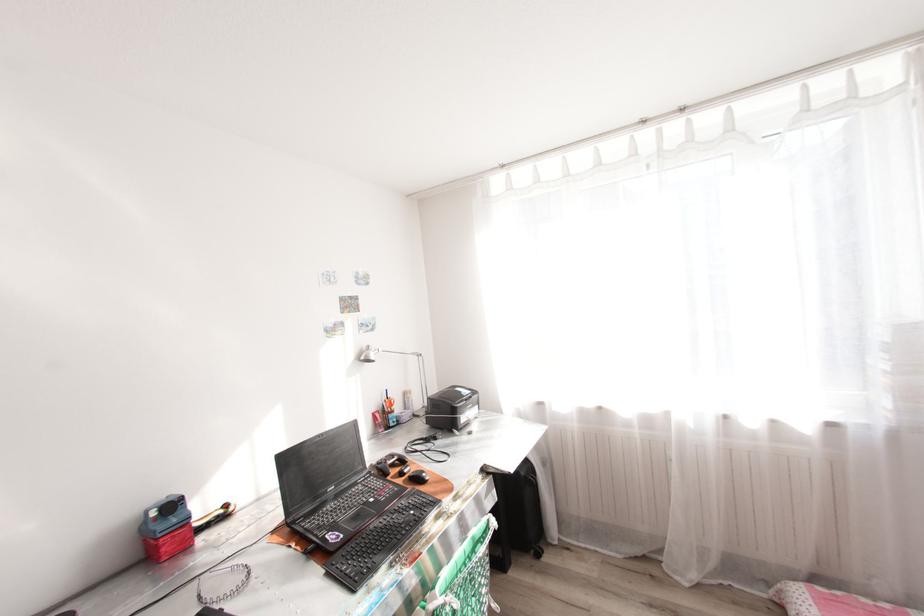
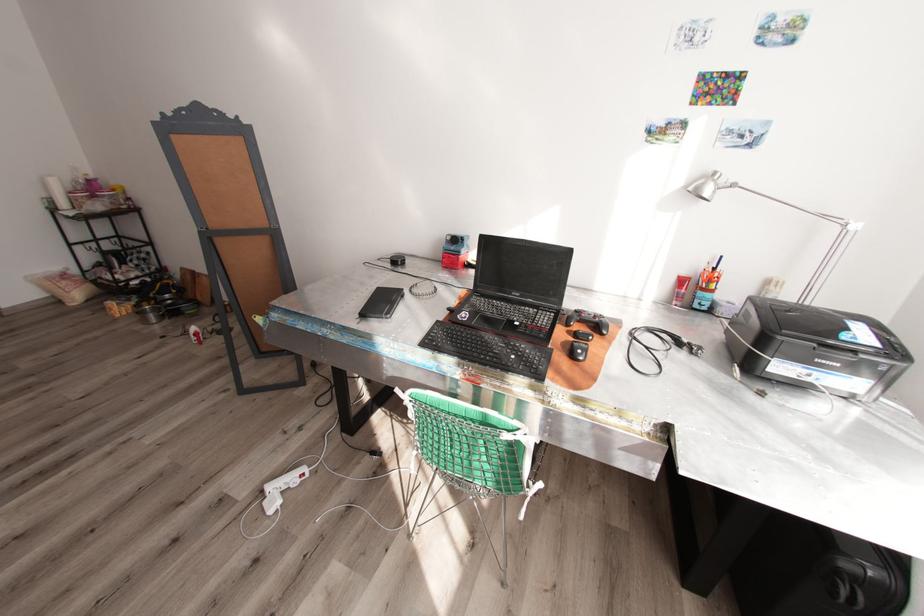
In the second image, find the point that corresponds to the point at 409,394 in the first image.

(772, 282)